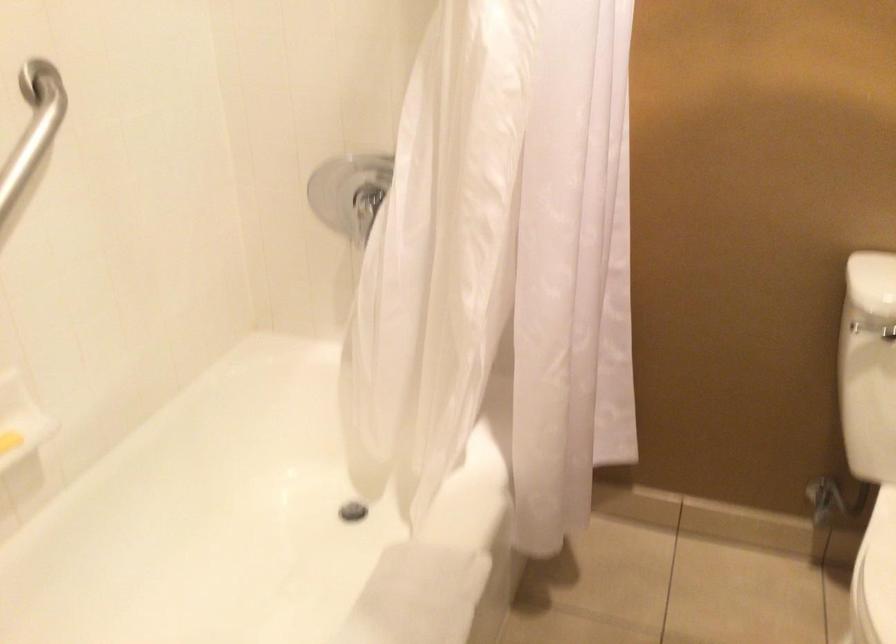
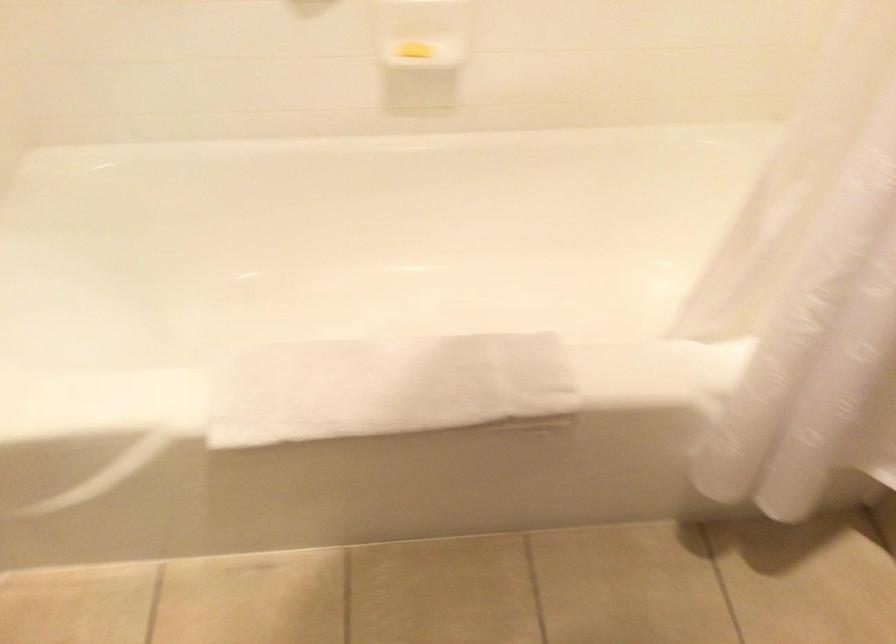
The images are taken continuously from a first-person perspective. In which direction is your viewpoint rotating?

The camera rotated toward left-down.